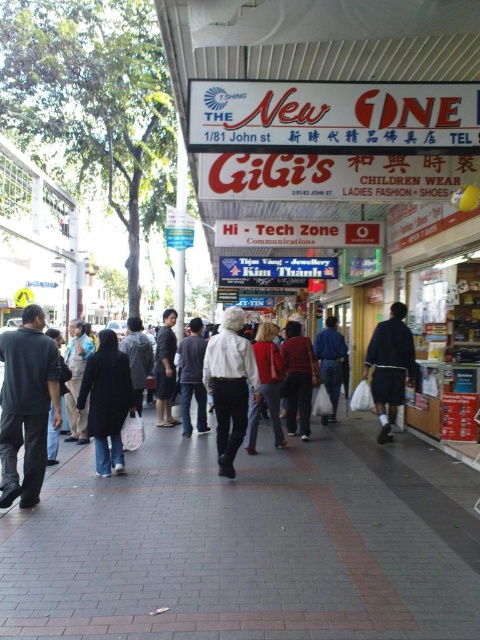
You are standing at the point labeled point (121,492) and want to walk towards the point labeled point (119,392). Which direction should you face to move towards it?

You should face towards the direction away from the camera because point (119,392) is further away from the camera compared to point (121,492).

You are a fashion designer observing the pedestrians on the bustling street. You notice two individuals wearing the matte red sweater at center and the dark gray fabric jacket at center. Which of these two items is closer to you?

The matte red sweater at center is closer to you because it is in front of the dark gray fabric jacket at center.

You are a fashion designer observing a busy street. You notice a matte red sweater at center and a dark gray fabric jacket at center. Which clothing item is closer to the ground?

The matte red sweater at center is positioned under the dark gray fabric jacket at center, so it is closer to the ground.